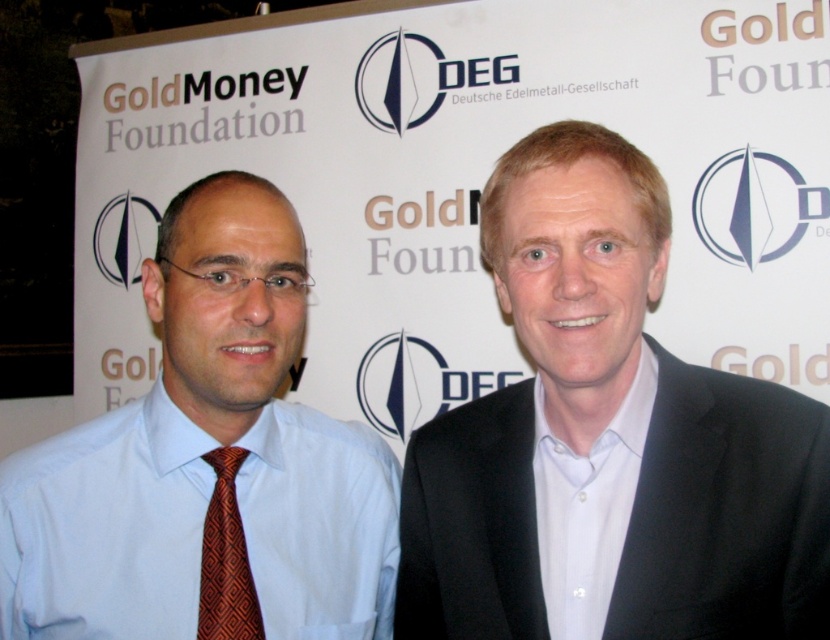
Measure the distance between black matte suit at right and orange patterned tie at left.

black matte suit at right and orange patterned tie at left are 14.97 inches apart from each other.

Between point (415, 474) and point (203, 547), which one is positioned in front?

Point (203, 547)

Locate an element on the screen. black matte suit at right is located at coordinates (608, 442).

Can you confirm if matte blue shirt at center is smaller than orange patterned tie at left?

No, matte blue shirt at center is not smaller than orange patterned tie at left.

Image resolution: width=830 pixels, height=640 pixels. Identify the location of matte blue shirt at center. (208, 465).

I want to click on matte blue shirt at center, so click(x=208, y=465).

I want to click on black matte suit at right, so click(608, 442).

Measure the distance from black matte suit at right to matte blue shirt at center.

black matte suit at right is 10.61 inches from matte blue shirt at center.

Does point (664, 444) come in front of point (213, 268)?

Yes, point (664, 444) is closer to viewer.

Image resolution: width=830 pixels, height=640 pixels. I want to click on black matte suit at right, so [x=608, y=442].